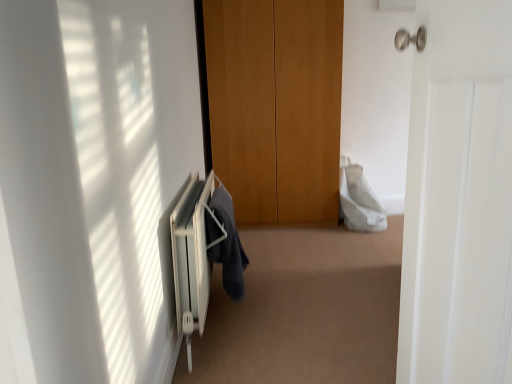
Question: Is dark gray fabric at lower center further to camera compared to white matte door at right?

Choices:
 (A) yes
 (B) no

Answer: (A)

Question: Is dark gray fabric at lower center positioned in front of white matte door at right?

Choices:
 (A) no
 (B) yes

Answer: (A)

Question: Is dark gray fabric at lower center not near white matte door at right?

Choices:
 (A) no
 (B) yes

Answer: (B)

Question: Can you confirm if dark gray fabric at lower center is taller than white matte door at right?

Choices:
 (A) no
 (B) yes

Answer: (A)

Question: Is dark gray fabric at lower center smaller than white matte door at right?

Choices:
 (A) yes
 (B) no

Answer: (A)

Question: From a real-world perspective, relative to white matte door at right, is white metallic radiator at lower left vertically above or below?

Choices:
 (A) above
 (B) below

Answer: (B)

Question: Which is correct: white metallic radiator at lower left is inside white matte door at right, or outside of it?

Choices:
 (A) outside
 (B) inside

Answer: (A)

Question: Is white metallic radiator at lower left taller or shorter than white matte door at right?

Choices:
 (A) short
 (B) tall

Answer: (A)

Question: Is white metallic radiator at lower left to the left or to the right of white matte door at right in the image?

Choices:
 (A) left
 (B) right

Answer: (A)

Question: Is white matte door at right in front of or behind white metallic radiator at lower left in the image?

Choices:
 (A) behind
 (B) front

Answer: (B)

Question: Is white matte door at right situated inside white metallic radiator at lower left or outside?

Choices:
 (A) outside
 (B) inside

Answer: (A)

Question: Looking at their shapes, would you say white matte door at right is wider or thinner than white metallic radiator at lower left?

Choices:
 (A) thin
 (B) wide

Answer: (B)

Question: Visually, is white matte door at right positioned to the left or to the right of white metallic radiator at lower left?

Choices:
 (A) left
 (B) right

Answer: (B)

Question: From the image's perspective, relative to white matte door at right, is dark gray fabric at lower center above or below?

Choices:
 (A) below
 (B) above

Answer: (A)

Question: In terms of size, does dark gray fabric at lower center appear bigger or smaller than white matte door at right?

Choices:
 (A) big
 (B) small

Answer: (B)